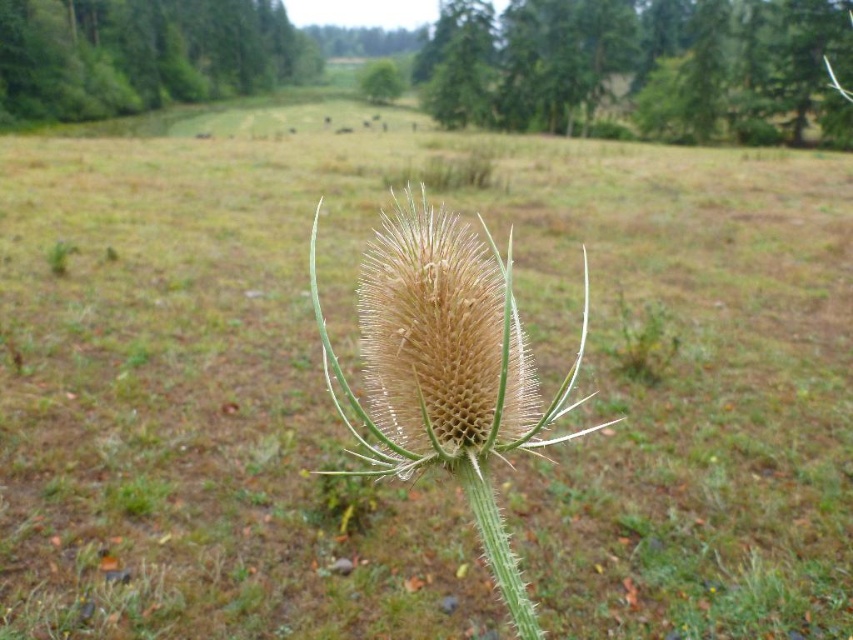
You are a botanist observing the teasel plant and the surrounding area. Which object, the green fuzzy tree at upper left or the green spiny stem at center, would you estimate to be bigger in size?

The green fuzzy tree at upper left is larger in size than the green spiny stem at center.

You are standing in the field looking at the teasel plant. There is a point marked at coordinates (641, 65). What object is located at that point?

The point at (641, 65) indicates a green textured tree at upper center.